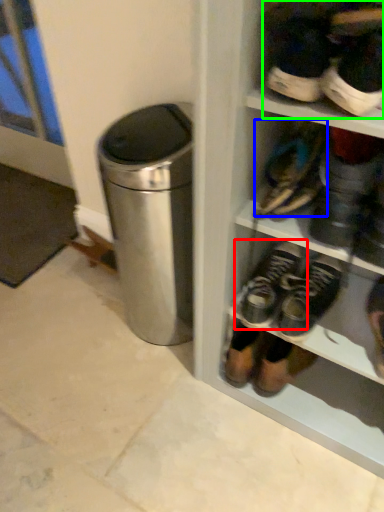
Question: Based on their relative distances, which object is farther from footwear (highlighted by a red box)? Choose from footwear (highlighted by a blue box) and footwear (highlighted by a green box).

Choices:
 (A) footwear
 (B) footwear

Answer: (B)